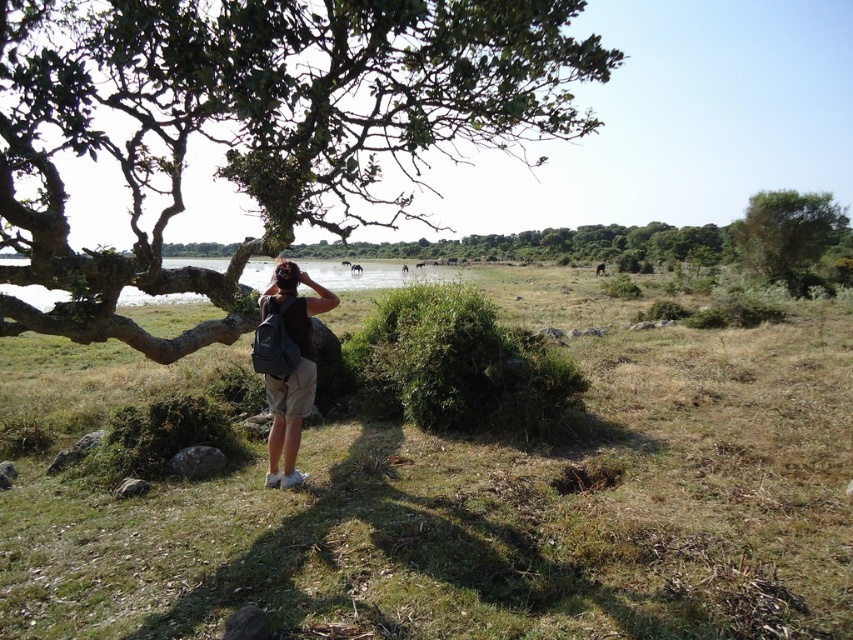
Between green leafy tree at upper left and black fabric backpack at center, which one has less height?

Standing shorter between the two is black fabric backpack at center.

Is green leafy tree at upper left positioned in front of black fabric backpack at center?

Yes, green leafy tree at upper left is in front of black fabric backpack at center.

Which is in front, point (335, 17) or point (277, 464)?

Positioned in front is point (335, 17).

Locate an element on the screen. The height and width of the screenshot is (640, 853). green leafy tree at upper left is located at coordinates (256, 125).

Does green grass at center appear on the right side of green leafy bush at upper right?

No, green grass at center is not to the right of green leafy bush at upper right.

Can you confirm if green grass at center is wider than green leafy bush at upper right?

Correct, the width of green grass at center exceeds that of green leafy bush at upper right.

You are a GUI agent. You are given a task and a screenshot of the screen. Output one action in this format:
    pyautogui.click(x=<x>, y=<y>)
    Task: Click on the green grass at center
    The height and width of the screenshot is (640, 853).
    Given the screenshot: What is the action you would take?
    pyautogui.click(x=495, y=509)

Does green grass at center appear over green leafy tree at upper left?

Incorrect, green grass at center is not positioned above green leafy tree at upper left.

This screenshot has height=640, width=853. I want to click on green grass at center, so click(x=495, y=509).